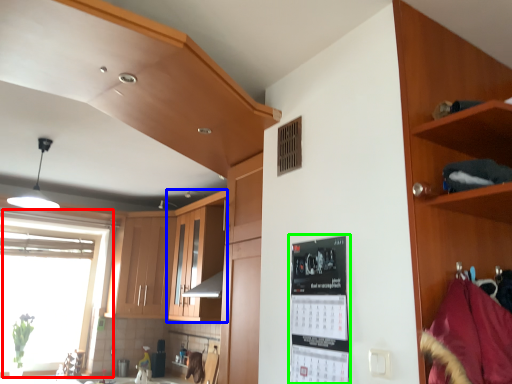
Question: Which is nearer to the window (highlighted by a red box)? cabinetry (highlighted by a blue box) or bulletin board (highlighted by a green box).

Choices:
 (A) cabinetry
 (B) bulletin board

Answer: (A)